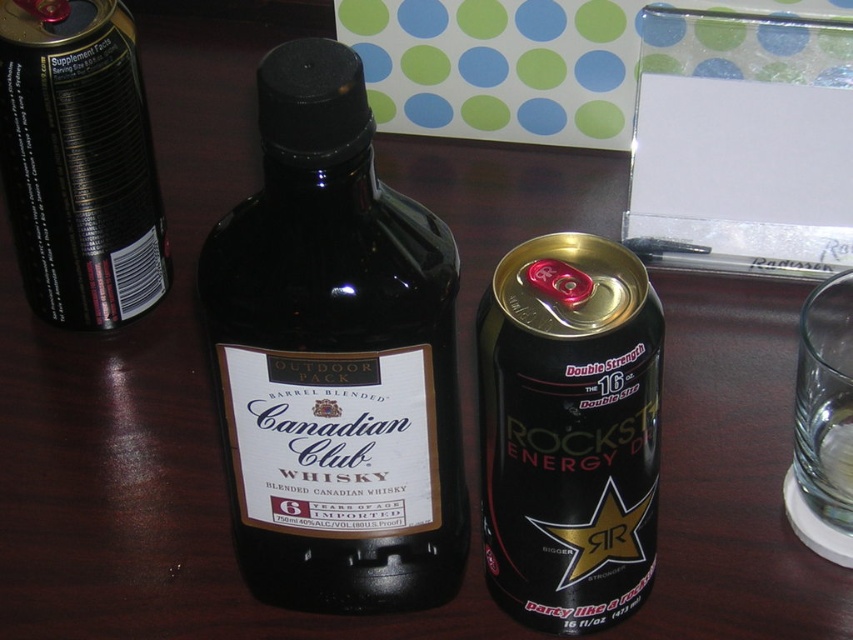
You are a delivery person who needs to place a new item between the black glass bottle at center and the Rockstar Double Strength can on the right. The new item is 15 inches long. Can you fit it there?

The distance between the black glass bottle at center and the Rockstar Double Strength can on the right is 14.98 inches. Since the new item is 15 inches long, it cannot fit in the space provided.

You are organizing a party and need to arrange the drinks on the table. You have a black metallic can at center and a black matte can at left. According to the scene, which can is closer to the right edge of the table?

The black metallic can at center is positioned on the right side of the black matte can at left, so the black metallic can at center is closer to the right edge of the table.

You are organizing a bar and need to place the black glass bottle at center and the black metallic can at center on a shelf. If the shelf has limited width, which item should you place first to ensure both fit?

The black metallic can at center is narrower than the black glass bottle at center. Place the wider black glass bottle at center first, then the narrower black metallic can at center to ensure both fit on the shelf.